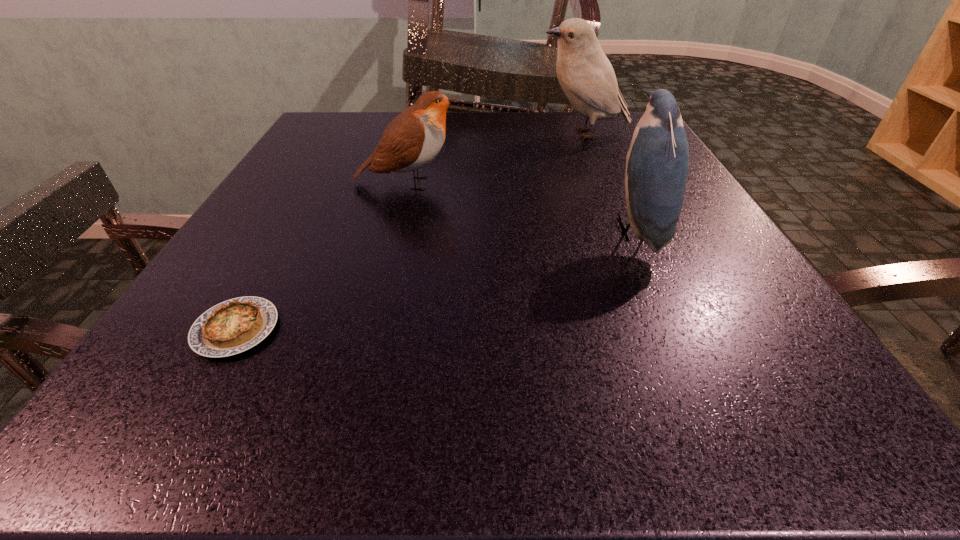
The image size is (960, 540). I want to click on free space between the nearest bird and the farthest bird, so click(x=609, y=182).

Identify the location of free space between the nearest bird and the shortest object. (436, 280).

Where is `vacant region between the third farthest object and the second nearest bird`? This screenshot has width=960, height=540. vacant region between the third farthest object and the second nearest bird is located at coordinates (521, 207).

The height and width of the screenshot is (540, 960). What are the coordinates of `blank region between the leftmost object and the farthest bird` in the screenshot? It's located at (410, 232).

Image resolution: width=960 pixels, height=540 pixels. Find the location of `object that stands as the second closest to the nearest bird`. object that stands as the second closest to the nearest bird is located at coordinates (413, 139).

Identify the location of object that ranks as the third closest to the farthest object. Image resolution: width=960 pixels, height=540 pixels. (233, 326).

Find the location of a particular element. the second closest bird to the leftmost object is located at coordinates (657, 163).

The width and height of the screenshot is (960, 540). I want to click on bird that is the third nearest to the shortest object, so click(x=585, y=74).

What are the coordinates of `vacant position in the image that satisfies the following two spatial constraints: 1. at the beak of the farthest object; 2. on the front side of the leftmost object` in the screenshot? It's located at (666, 329).